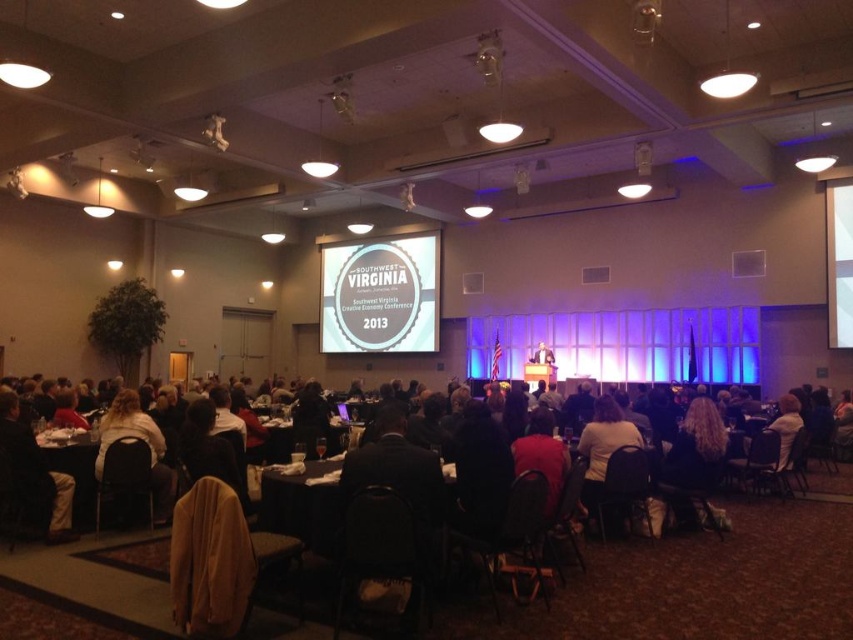
You are organizing a small meeting and need to place a dark brown leather jacket at center on a black fabric table at center. Will the jacket fit on the table?

The black fabric table at center is smaller than the dark brown leather jacket at center, so the jacket will not fit on the table.

You are organizing a small meeting and need to place a dark brown leather jacket at center on a black fabric table at center. Will the jacket fit on the table without hanging over the edges?

The black fabric table at center has a lesser width compared to dark brown leather jacket at center, so the jacket will hang over the edges of the table.